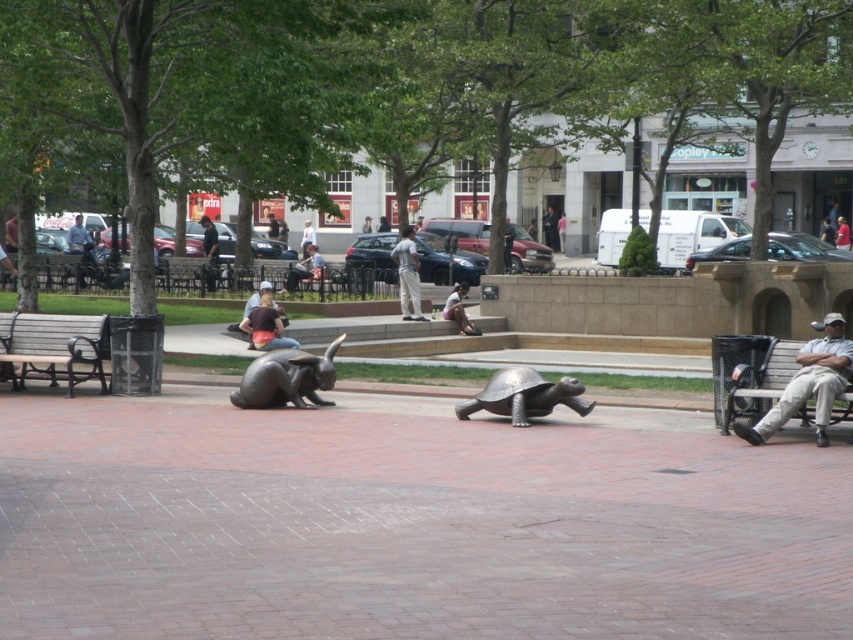
You are standing in the park and want to walk to both the rabbit sculpture and the turtle sculpture. The rabbit sculpture is at point (804,364) and the turtle sculpture is at point (302,243). Which sculpture should you visit first if you want to start from the closest one to you?

You should visit the rabbit sculpture at point (804,364) first because it is closer to you than the turtle sculpture at point (302,243).

You are standing at the center of the plaza and want to sit on the wooden bench at left. Which direction should you walk to reach it?

The wooden bench at left is located at point (x=53, y=346), so you should walk towards the left side of the plaza to reach it.